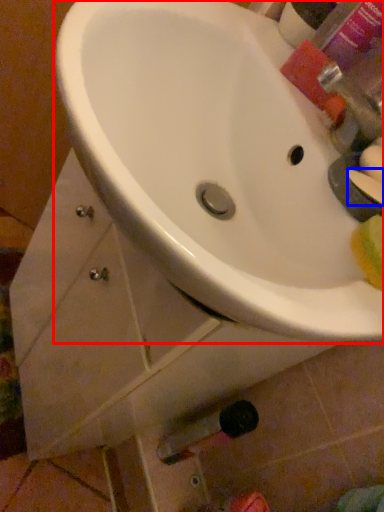
Question: Which object appears farthest to the camera in this image, sink (highlighted by a red box) or soap (highlighted by a blue box)?

Choices:
 (A) sink
 (B) soap

Answer: (B)